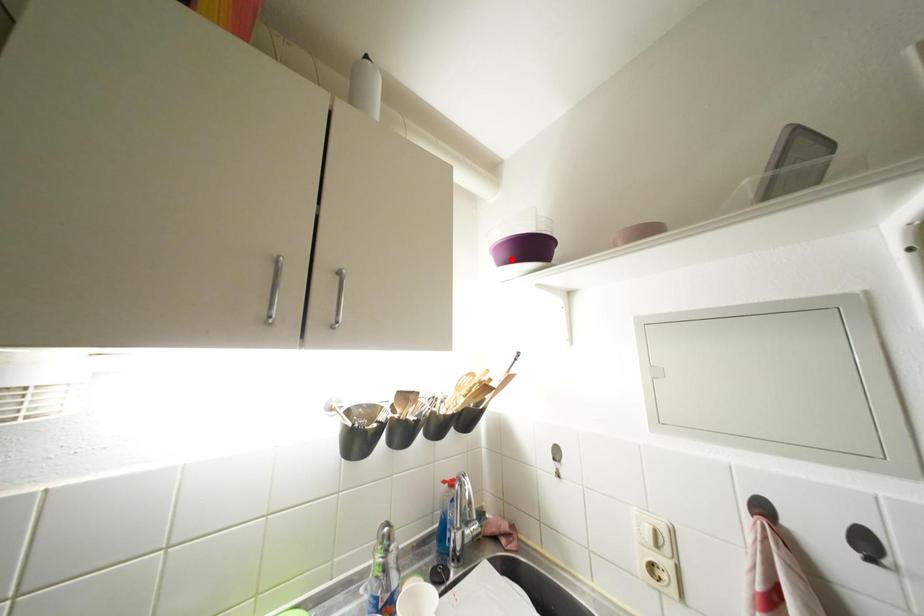
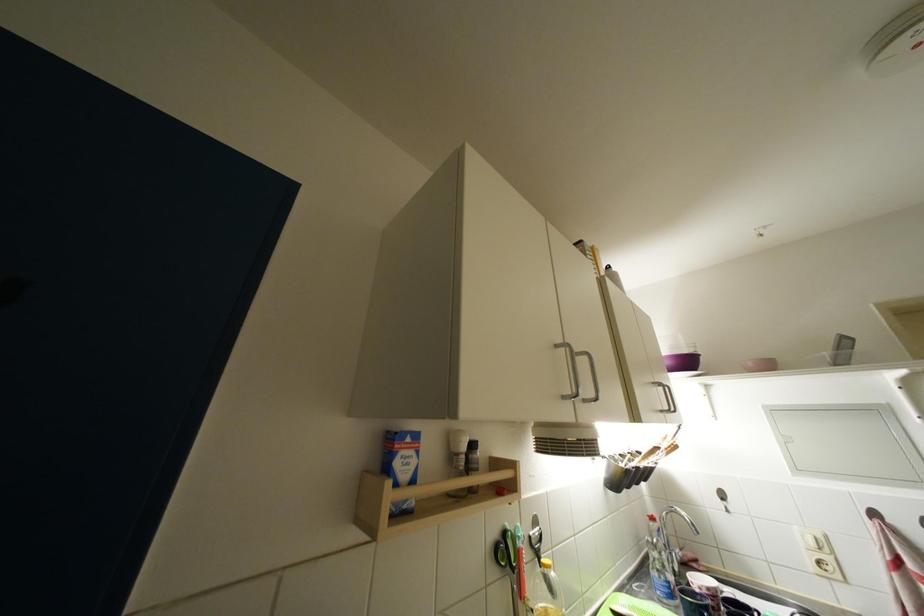
The point at the highlighted location is marked in the first image. Where is the corresponding point in the second image?

(675, 367)